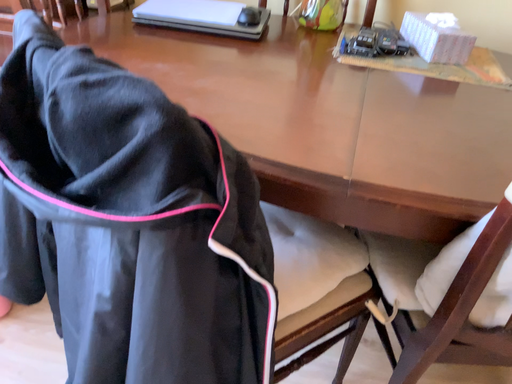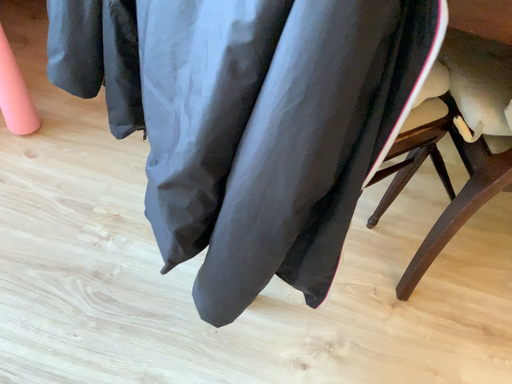
Question: How did the camera likely rotate when shooting the video?

Choices:
 (A) rotated upward
 (B) rotated downward

Answer: (B)